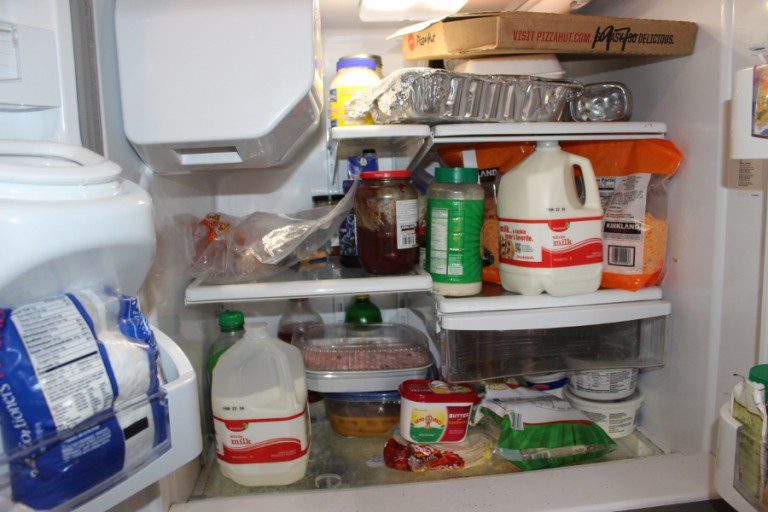
Locate an element on the screen. This screenshot has height=512, width=768. light is located at coordinates (441, 455), (394, 7).